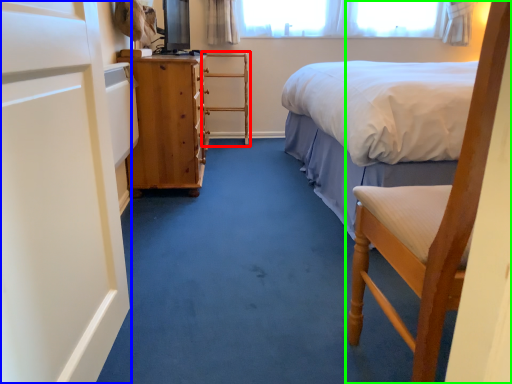
Question: Which is nearer to the armchair (highlighted by a red box)? screen door (highlighted by a blue box) or chair (highlighted by a green box).

Choices:
 (A) screen door
 (B) chair

Answer: (A)